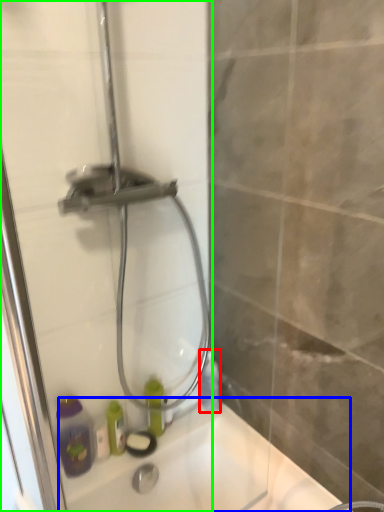
Question: Based on their relative distances, which object is nearer to bottle (highlighted by a red box)? Choose from bath (highlighted by a blue box) and shower door (highlighted by a green box).

Choices:
 (A) bath
 (B) shower door

Answer: (A)